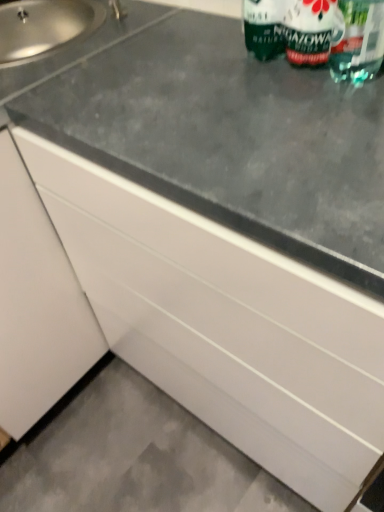
Where is `free space in front of green matte bottle at upper right`? This screenshot has width=384, height=512. free space in front of green matte bottle at upper right is located at coordinates (299, 102).